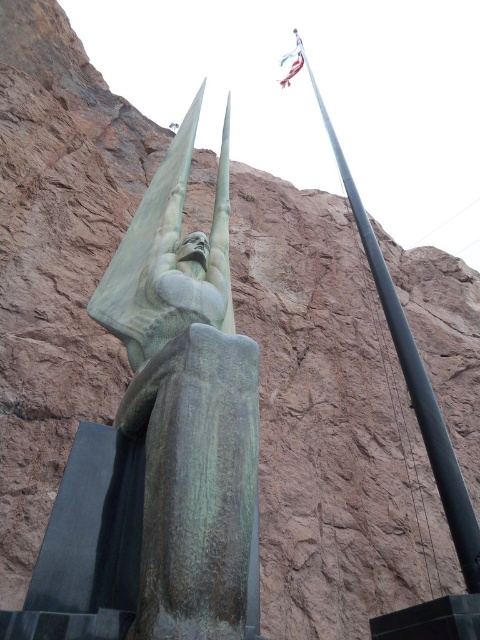
You are standing at point (215,401) and want to walk to the statue. Is the statue to your left or right?

The statue is to your right because the distance between you and the statue is 11.84 meters, but the exact direction requires knowing the coordinate system. Since the flagpole is to the right of the statue, and assuming standard coordinates, the statue would be to your left if you are at the given point.

You are a photographer standing at the base of the statue and want to take a photo that includes both the green patina statue at center and the black metallic pole at upper right. Based on their positions, which object should you adjust your camera to focus on first to ensure both are in the frame?

The green patina statue at center is to the left of the black metallic pole at upper right, so you should focus on the black metallic pole at upper right first to ensure both are captured in the frame.

You are standing at the camera position and want to take a photo of the green patina statue at center. If your camera has a maximum focus range of 10 meters, will you be able to focus on the statue?

The green patina statue at center and camera are 9.02 meters apart. Since the distance is within the camera maximum focus range of 10 meters, you can focus on the statue.